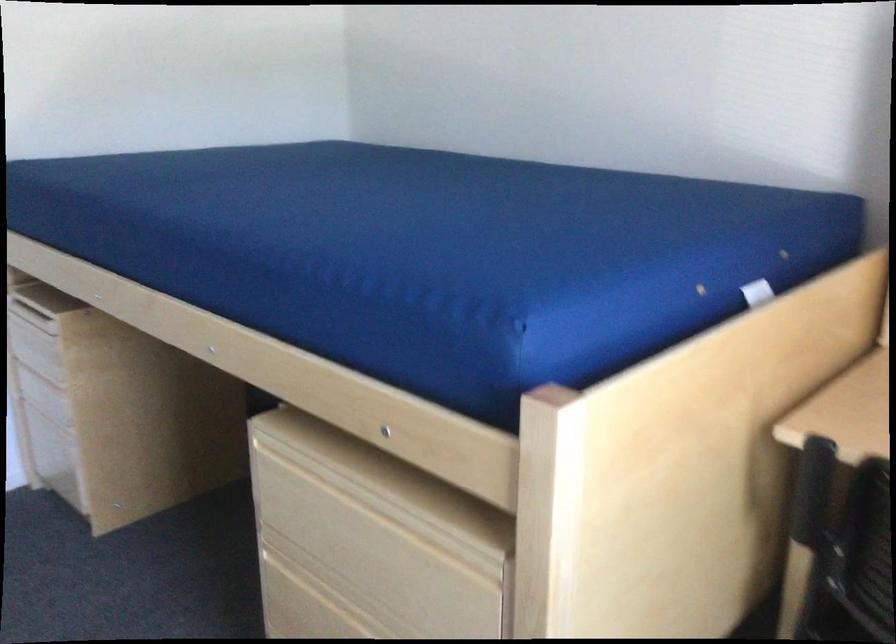
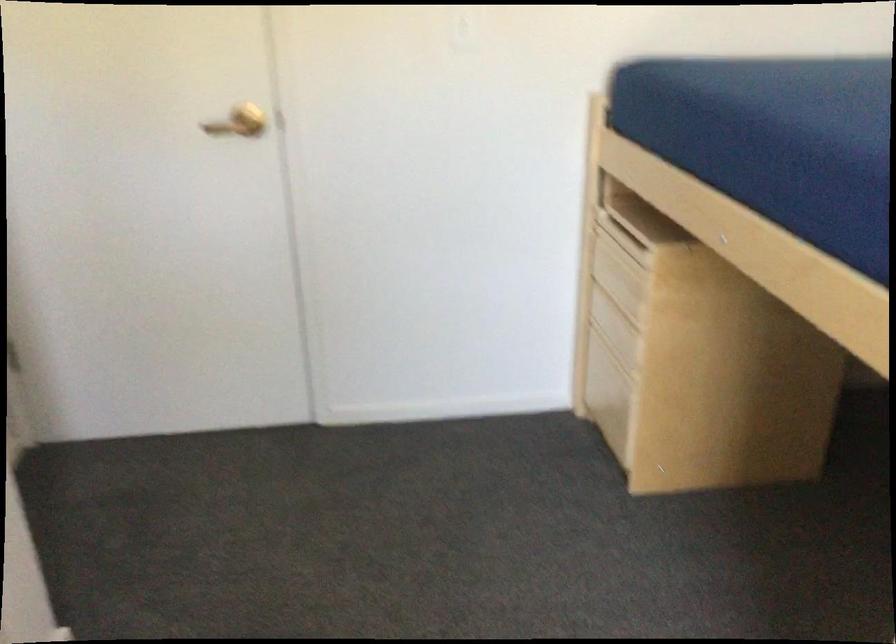
Question: The camera is either moving clockwise (left) or counter-clockwise (right) around the object. The first image is from the beginning of the video and the second image is from the end. Is the camera moving left or right when shooting the video?

Choices:
 (A) Left
 (B) Right

Answer: (B)